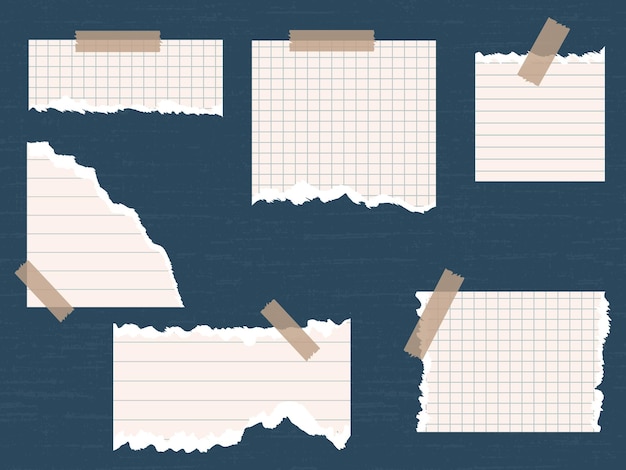
What are the coordinates of `tape` in the screenshot? It's located at (541, 44), (362, 40), (144, 39), (46, 296), (279, 316), (437, 307).